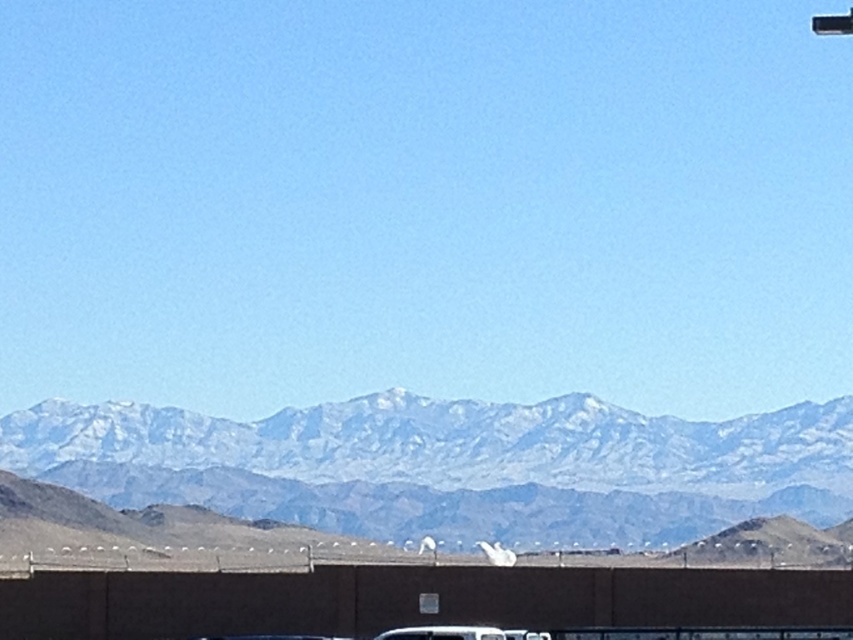
Question: Can you confirm if brown concrete overpass at lower center is positioned below white matte car at lower center?

Choices:
 (A) no
 (B) yes

Answer: (B)

Question: Does snowy rocky mountain range at center come in front of white matte car at lower center?

Choices:
 (A) yes
 (B) no

Answer: (B)

Question: Which point is closer to the camera?

Choices:
 (A) (720, 588)
 (B) (184, 444)
 (C) (397, 637)

Answer: (C)

Question: Based on their relative distances, which object is farther from the snowy rocky mountain range at center?

Choices:
 (A) brown concrete overpass at lower center
 (B) white matte car at lower center

Answer: (B)

Question: Is snowy rocky mountain range at center wider than white matte car at lower center?

Choices:
 (A) yes
 (B) no

Answer: (A)

Question: Based on their relative distances, which object is farther from the white matte car at lower center?

Choices:
 (A) brown concrete overpass at lower center
 (B) snowy rocky mountain range at center

Answer: (B)